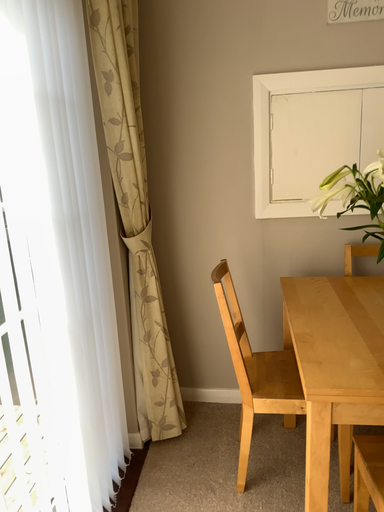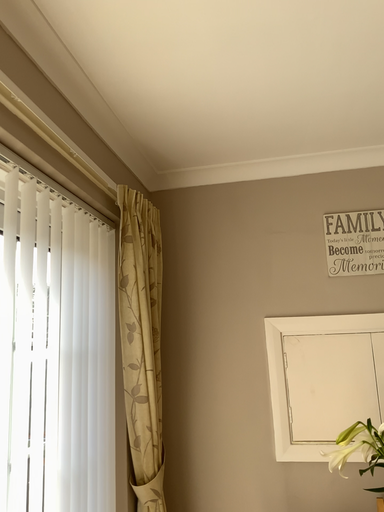
Question: Which way did the camera rotate in the video?

Choices:
 (A) rotated downward
 (B) rotated upward

Answer: (B)